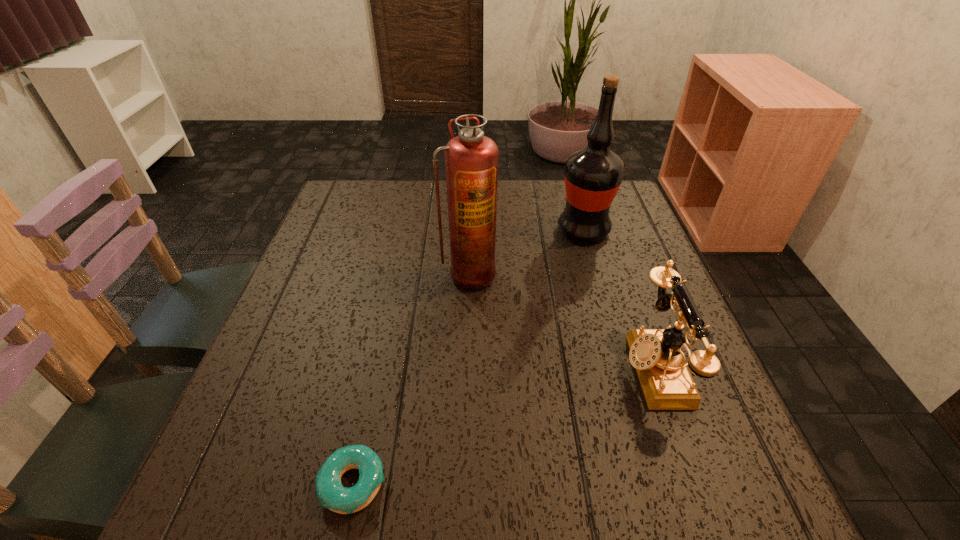
Image resolution: width=960 pixels, height=540 pixels. In order to click on vacant area that lies between the telephone and the farthest object in this screenshot , I will do `click(619, 299)`.

You are a GUI agent. You are given a task and a screenshot of the screen. Output one action in this format:
    pyautogui.click(x=<x>, y=<y>)
    Task: Click on the empty space that is in between the wine bottle and the nearest object
    This screenshot has width=960, height=540.
    Given the screenshot: What is the action you would take?
    pyautogui.click(x=468, y=357)

This screenshot has height=540, width=960. Identify the location of free space between the fire extinguisher and the farthest object. (526, 252).

Find the location of a particular element. This screenshot has width=960, height=540. free space between the wine bottle and the fire extinguisher is located at coordinates (526, 252).

You are a GUI agent. You are given a task and a screenshot of the screen. Output one action in this format:
    pyautogui.click(x=<x>, y=<y>)
    Task: Click on the third closest object to the wine bottle
    The image size is (960, 540).
    Given the screenshot: What is the action you would take?
    (332, 495)

The height and width of the screenshot is (540, 960). I want to click on object that is the third closest to the farthest object, so click(x=332, y=495).

In order to click on free space that satisfies the following two spatial constraints: 1. on the dial of the second nearest object; 2. on the front side of the nearest object in this screenshot , I will do coord(695,484).